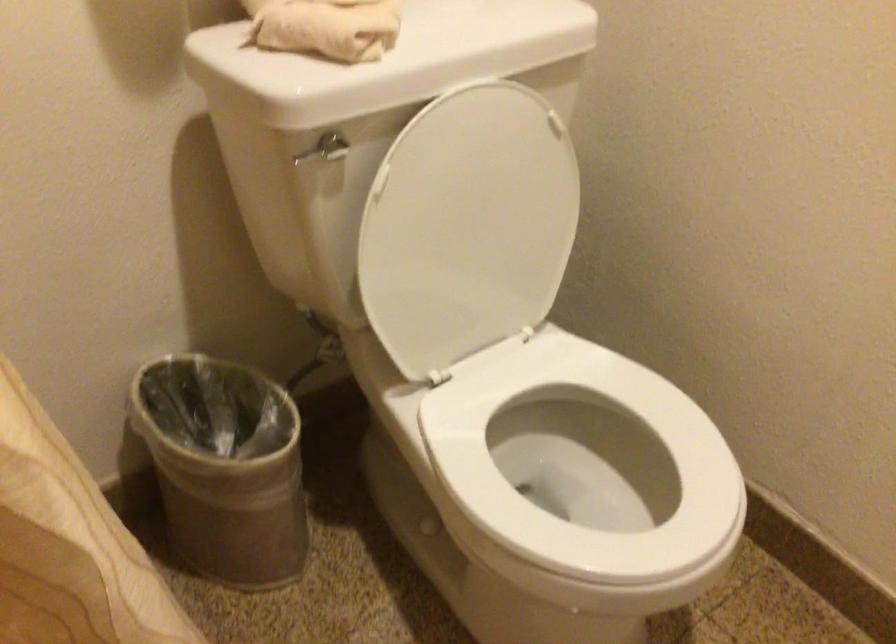
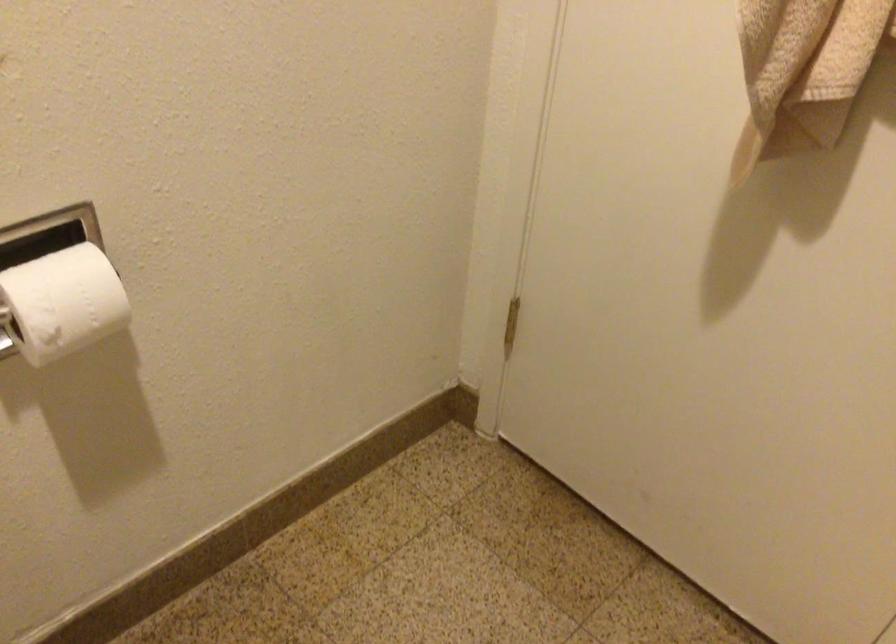
How did the camera likely rotate?

The camera rotated toward right-down.